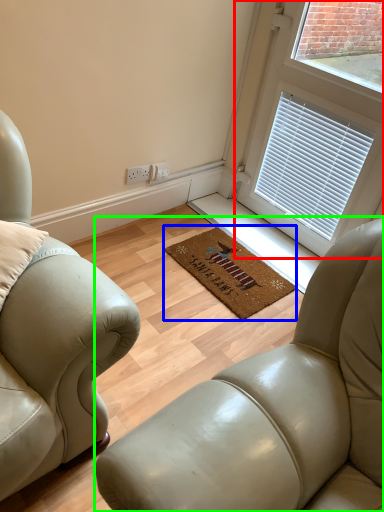
Question: Estimate the real-world distances between objects in this image. Which object is farther from window (highlighted by a red box), mat (highlighted by a blue box) or studio couch (highlighted by a green box)?

Choices:
 (A) mat
 (B) studio couch

Answer: (B)